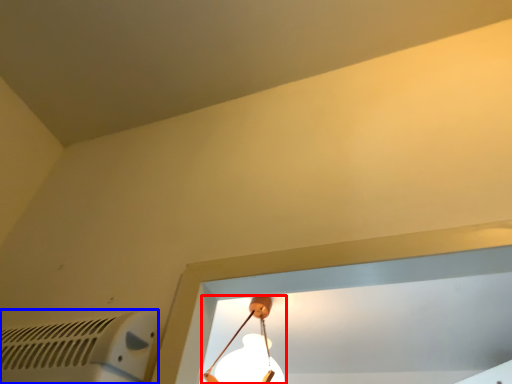
Question: Which object appears closest to the camera in this image, lamp (highlighted by a red box) or air conditioning (highlighted by a blue box)?

Choices:
 (A) lamp
 (B) air conditioning

Answer: (B)